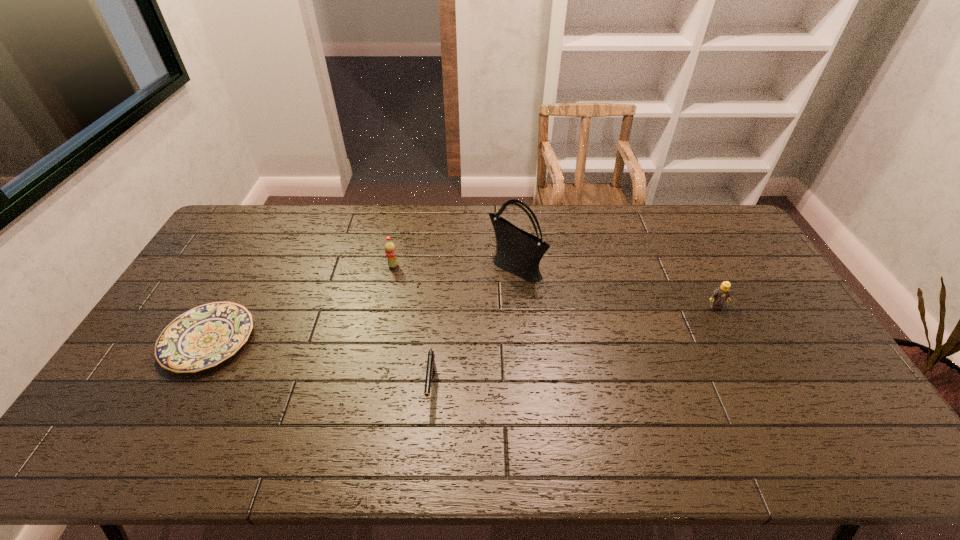
At what (x,y) coordinates should I click in order to perform the action: click on vacant space located on the front of the shoulder bag. Please return your answer as a coordinate pair (x, y). The image size is (960, 540). Looking at the image, I should click on (523, 360).

Find the location of a particular element. vacant space located 0.290m on the back of the soda is located at coordinates (404, 213).

This screenshot has height=540, width=960. I want to click on blank space located in front of the third shortest object, so click(741, 357).

Locate an element on the screen. The width and height of the screenshot is (960, 540). vacant space situated 0.060m at the muzzle of the pistol is located at coordinates (427, 434).

Find the location of `free spot located on the back of the plate`. free spot located on the back of the plate is located at coordinates [x=242, y=280].

The image size is (960, 540). Find the location of `object present at the left edge`. object present at the left edge is located at coordinates (203, 337).

Identify the location of vacant space at the far edge. (528, 227).

Identify the location of free space at the near edge of the desktop. (709, 461).

Find the location of a particular element. vacant area at the left edge is located at coordinates (252, 246).

Find the location of a particular element. The width and height of the screenshot is (960, 540). vacant region at the right edge of the desktop is located at coordinates (795, 319).